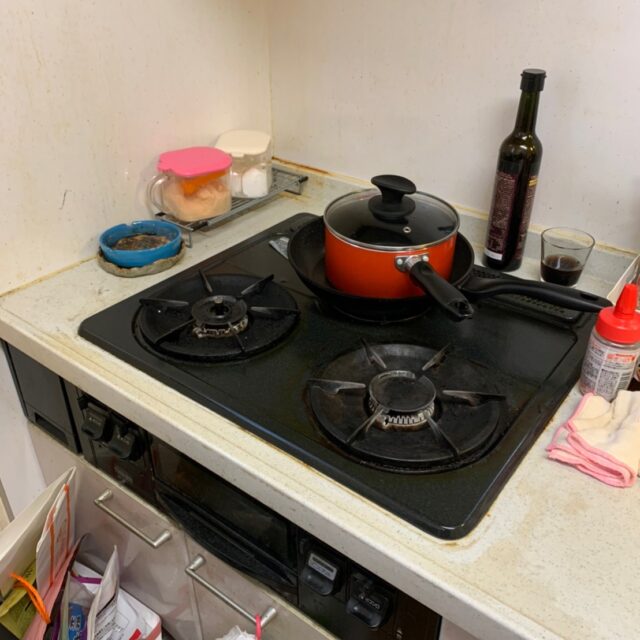
At what (x,y) coordinates should I click in order to perform the action: click on glass. Please return your answer as a coordinate pair (x, y). The width and height of the screenshot is (640, 640). Looking at the image, I should click on (563, 264).